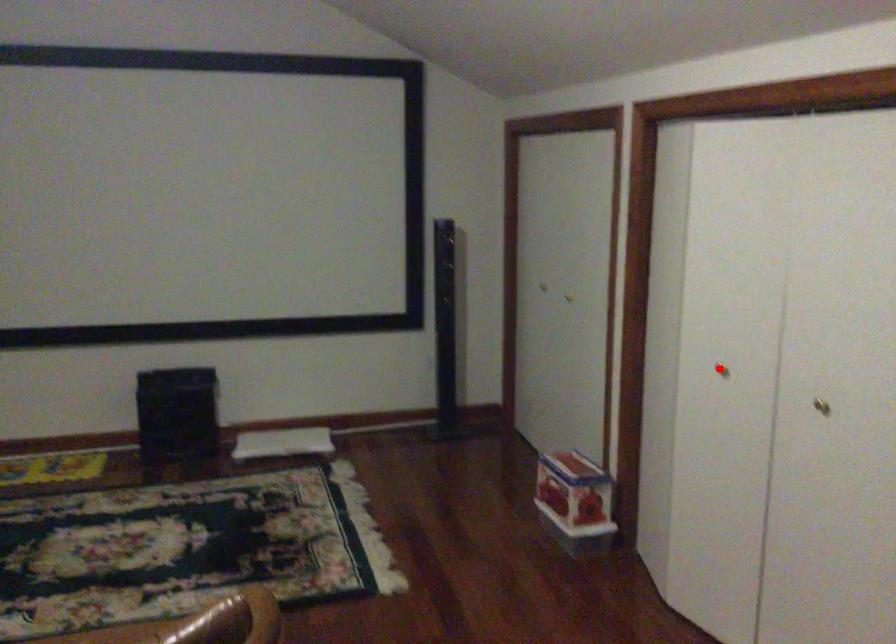
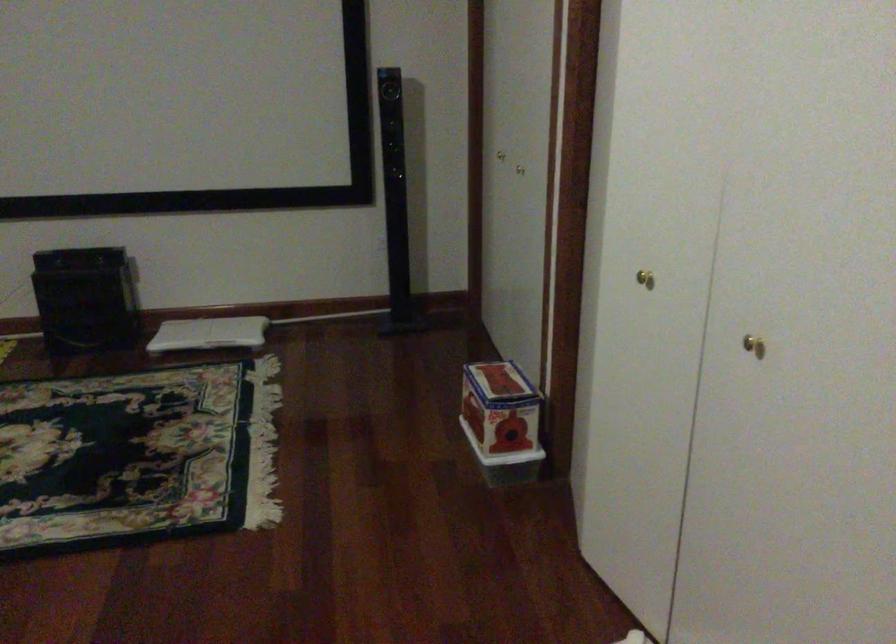
Question: I am providing you with two images of the same scene from different viewpoints. A red point is shown in image1. For the corresponding object point in image2, is it positioned nearer or farther from the camera?

Choices:
 (A) Nearer
 (B) Farther

Answer: (A)